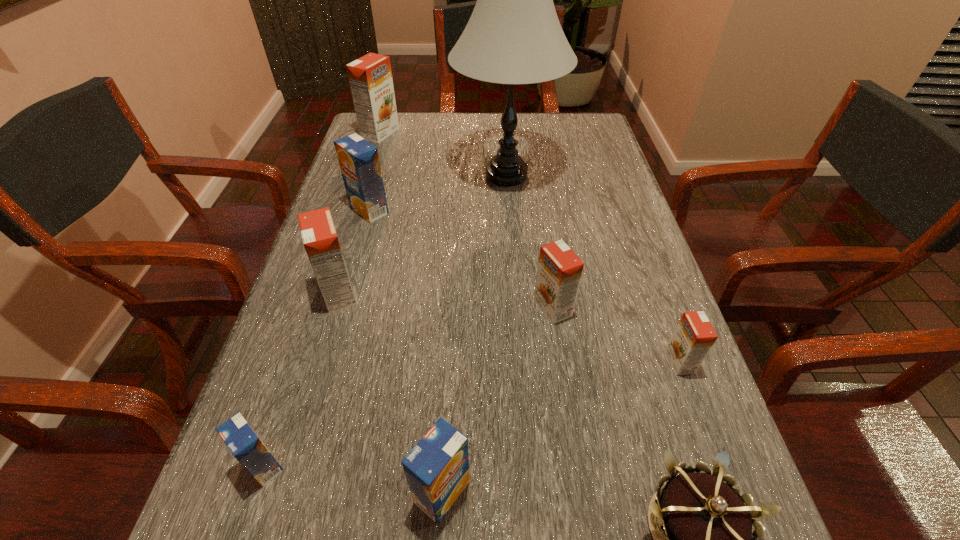
The height and width of the screenshot is (540, 960). What are the coordinates of `vacant space located on the right of the smallest blue orange_juice` in the screenshot? It's located at (492, 466).

Find the location of a particular element. vacant space situated 0.290m on the back of the nearest orange orange juice is located at coordinates (636, 243).

The height and width of the screenshot is (540, 960). What are the coordinates of `lamp situated at the far edge` in the screenshot? It's located at (514, 36).

At what (x,y) coordinates should I click in order to perform the action: click on orange juice present at the far edge. Please return your answer as a coordinate pair (x, y). Looking at the image, I should click on (370, 77).

This screenshot has width=960, height=540. In order to click on lamp positioned at the right edge in this screenshot , I will do `click(514, 36)`.

Locate an element on the screen. Image resolution: width=960 pixels, height=540 pixels. orange juice that is at the right edge is located at coordinates (694, 336).

The height and width of the screenshot is (540, 960). Identify the location of object present at the far left corner. (370, 77).

Locate an element on the screen. This screenshot has width=960, height=540. object at the far right corner is located at coordinates point(514,36).

You are a GUI agent. You are given a task and a screenshot of the screen. Output one action in this format:
    pyautogui.click(x=<x>, y=<y>)
    Task: Click on the free region at the far edge of the desktop
    
    Given the screenshot: What is the action you would take?
    pyautogui.click(x=424, y=131)

Locate an element on the screen. free spot at the left edge of the desktop is located at coordinates (355, 294).